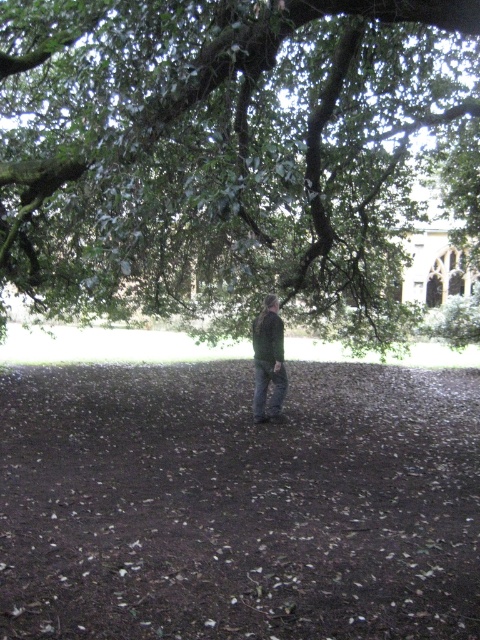
You are standing at the center of the image and want to walk towards the green leafy tree at upper center. Which direction should you face to head directly towards it?

The green leafy tree at upper center is located at point coordinates, so you should face the upper center direction to head directly towards it.

You are a photographer trying to capture the green leafy tree at upper center and the brown soil at center in the same frame. Which object should you focus on first to ensure both are in focus?

You should focus on the green leafy tree at upper center first because it is closer to you than the brown soil at center, so focusing on the closer object will help both be in focus.

Consider the image. You are a photographer trying to capture the green matte jacket at center and the brown soil at center in the same frame. Based on their heights, which one will appear closer to the camera?

The green matte jacket at center is taller than the brown soil at center, so it will appear closer to the camera.